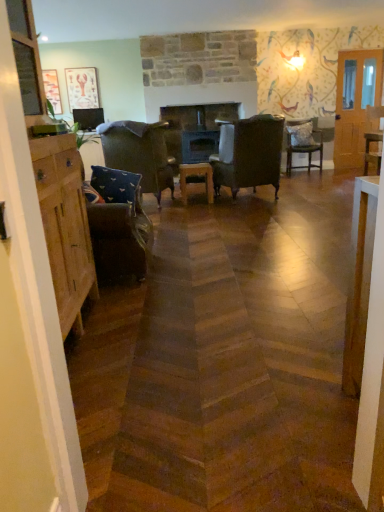
What is the approximate height of smooth dark wood fireplace at center?

1.04 meters.

What are the coordinates of `blue fabric pillow at left, placed as the 1th pillow when sorted from left to right` in the screenshot? It's located at (117, 186).

The width and height of the screenshot is (384, 512). What do you see at coordinates (249, 154) in the screenshot?
I see `brown leather chair at center, which is the 3th chair from right to left` at bounding box center [249, 154].

What is the approximate width of matte wooden picture frame at upper left, which is the first picture frame in left-to-right order?

matte wooden picture frame at upper left, which is the first picture frame in left-to-right order, is 1.96 inches in width.

Locate an element on the screen. This screenshot has height=512, width=384. matte wooden picture frame at upper left, which is the 2th picture frame in right-to-left order is located at coordinates (52, 90).

Image resolution: width=384 pixels, height=512 pixels. Describe the element at coordinates (302, 143) in the screenshot. I see `patterned fabric chair at center-right, arranged as the third chair when viewed from the left` at that location.

Where is `wooden stool at center`? This screenshot has height=512, width=384. wooden stool at center is located at coordinates (196, 180).

Is transparent glass door at right positioned beyond the bounds of matte wooden picture frame at upper left, which is the 2th picture frame in right-to-left order?

That's correct, transparent glass door at right is outside of matte wooden picture frame at upper left, which is the 2th picture frame in right-to-left order.

Is transparent glass door at right smaller than matte wooden picture frame at upper left, which is the 2th picture frame in right-to-left order?

Actually, transparent glass door at right might be larger than matte wooden picture frame at upper left, which is the 2th picture frame in right-to-left order.

Visually, is transparent glass door at right positioned to the left or to the right of matte wooden picture frame at upper left, which is the 2th picture frame in right-to-left order?

In the image, transparent glass door at right appears on the right side of matte wooden picture frame at upper left, which is the 2th picture frame in right-to-left order.

Looking at this image, considering the sizes of objects transparent glass door at right and matte wooden picture frame at upper left, which is the first picture frame in left-to-right order, in the image provided, who is taller, transparent glass door at right or matte wooden picture frame at upper left, which is the first picture frame in left-to-right order,?

transparent glass door at right.

Considering the relative positions of wooden chair at right, positioned as the 4th chair in left-to-right order, and wooden stool at center in the image provided, is wooden chair at right, positioned as the 4th chair in left-to-right order, to the right of wooden stool at center from the viewer's perspective?

Yes, wooden chair at right, positioned as the 4th chair in left-to-right order, is to the right of wooden stool at center.

Could you tell me if wooden chair at right, which appears as the 1th chair when viewed from the right, is facing wooden stool at center?

No, wooden chair at right, which appears as the 1th chair when viewed from the right, does not turn towards wooden stool at center.

From a real-world perspective, is wooden chair at right, which appears as the 1th chair when viewed from the right, positioned under wooden stool at center based on gravity?

No, from a real-world perspective, wooden chair at right, which appears as the 1th chair when viewed from the right, is not under wooden stool at center.

From the image's perspective, between wooden chair at right, positioned as the 4th chair in left-to-right order, and wooden stool at center, who is located below?

wooden stool at center, from the image's perspective.

Can you confirm if blue fabric pillow at left, marked as the second pillow in a right-to-left arrangement, is positioned to the right of patterned fabric chair at center-right, arranged as the third chair when viewed from the left?

Incorrect, blue fabric pillow at left, marked as the second pillow in a right-to-left arrangement, is not on the right side of patterned fabric chair at center-right, arranged as the third chair when viewed from the left.

From a real-world perspective, does blue fabric pillow at left, which is the 1th pillow from bottom to top, sit lower than patterned fabric chair at center-right, arranged as the third chair when viewed from the left?

No, from a real-world perspective, blue fabric pillow at left, which is the 1th pillow from bottom to top, is not under patterned fabric chair at center-right, arranged as the third chair when viewed from the left.

Considering the sizes of objects blue fabric pillow at left, which is the 1th pillow from bottom to top, and patterned fabric chair at center-right, arranged as the third chair when viewed from the left, in the image provided, who is bigger, blue fabric pillow at left, which is the 1th pillow from bottom to top, or patterned fabric chair at center-right, arranged as the third chair when viewed from the left,?

With larger size is patterned fabric chair at center-right, arranged as the third chair when viewed from the left.

Starting from the blue fabric pillow at left, marked as the second pillow in a right-to-left arrangement, which chair is the 4th one behind? Please provide its 2D coordinates.

[(302, 143)]

In the image, is textured gray pillow at center-right, which ranks as the 1th pillow in top-to-bottom order, positioned in front of or behind wooden chair at right, positioned as the 4th chair in left-to-right order?

textured gray pillow at center-right, which ranks as the 1th pillow in top-to-bottom order, is behind wooden chair at right, positioned as the 4th chair in left-to-right order.

Who is shorter, textured gray pillow at center-right, which appears as the first pillow when viewed from the back, or wooden chair at right, positioned as the 4th chair in left-to-right order?

textured gray pillow at center-right, which appears as the first pillow when viewed from the back, is shorter.

Is textured gray pillow at center-right, which appears as the first pillow when viewed from the back, oriented away from wooden chair at right, which appears as the 1th chair when viewed from the right?

No.

Does textured gray pillow at center-right, which appears as the first pillow when viewed from the back, have a lesser width compared to wooden chair at right, which appears as the 1th chair when viewed from the right?

Indeed, textured gray pillow at center-right, which appears as the first pillow when viewed from the back, has a lesser width compared to wooden chair at right, which appears as the 1th chair when viewed from the right.

Considering the positions of point (379, 168) and point (88, 70), is point (379, 168) closer or farther from the camera than point (88, 70)?

Point (379, 168) appears to be closer to the viewer than point (88, 70).

Is matte paper picture frame at upper left, the second picture frame when ordered from left to right, at the back of wooden chair at right, which appears as the 1th chair when viewed from the right?

wooden chair at right, which appears as the 1th chair when viewed from the right, is not turned away from matte paper picture frame at upper left, the second picture frame when ordered from left to right.

Considering the relative sizes of wooden chair at right, which appears as the 1th chair when viewed from the right, and matte paper picture frame at upper left, the second picture frame when ordered from left to right, in the image provided, is wooden chair at right, which appears as the 1th chair when viewed from the right, shorter than matte paper picture frame at upper left, the second picture frame when ordered from left to right,?

In fact, wooden chair at right, which appears as the 1th chair when viewed from the right, may be taller than matte paper picture frame at upper left, the second picture frame when ordered from left to right.

Can you confirm if textured gray pillow at center-right, which appears as the first pillow when viewed from the back, is positioned to the left of brown leather chair at center, positioned as the second chair in left-to-right order?

Incorrect, textured gray pillow at center-right, which appears as the first pillow when viewed from the back, is not on the left side of brown leather chair at center, positioned as the second chair in left-to-right order.

From the image's perspective, is textured gray pillow at center-right, which ranks as the 1th pillow in top-to-bottom order, above or below brown leather chair at center, which is the 3th chair from right to left?

Based on their image positions, textured gray pillow at center-right, which ranks as the 1th pillow in top-to-bottom order, is located above brown leather chair at center, which is the 3th chair from right to left.

Based on the photo, which object is thinner, textured gray pillow at center-right, the 2th pillow in the front-to-back sequence, or brown leather chair at center, positioned as the second chair in left-to-right order?

textured gray pillow at center-right, the 2th pillow in the front-to-back sequence, is thinner.

Is textured gray pillow at center-right, which appears as the first pillow when viewed from the back, facing away from brown leather chair at center, positioned as the second chair in left-to-right order?

textured gray pillow at center-right, which appears as the first pillow when viewed from the back, is not turned away from brown leather chair at center, positioned as the second chair in left-to-right order.

Is velvet green armchair at center, arranged as the first chair when viewed from the left, not within textured gray pillow at center-right, the 2th pillow ordered from the bottom?

velvet green armchair at center, arranged as the first chair when viewed from the left, lies outside textured gray pillow at center-right, the 2th pillow ordered from the bottom,'s area.

From the image's perspective, between velvet green armchair at center, the fourth chair positioned from the right, and textured gray pillow at center-right, the 2th pillow ordered from the bottom, who is located below?

velvet green armchair at center, the fourth chair positioned from the right.

From a real-world perspective, is velvet green armchair at center, arranged as the first chair when viewed from the left, on textured gray pillow at center-right, the 2th pillow in the front-to-back sequence?

Actually, velvet green armchair at center, arranged as the first chair when viewed from the left, is physically below textured gray pillow at center-right, the 2th pillow in the front-to-back sequence, in the real world.

From the image's perspective, which picture frame is the 1st one above the transparent glass door at right? Please provide its 2D coordinates.

[(52, 90)]

At what (x,y) coordinates should I click in order to perform the action: click on table on the left of the wooden chair at right, positioned as the 4th chair in left-to-right order. Please return your answer as a coordinate pair (x, y). This screenshot has width=384, height=512. Looking at the image, I should click on (196, 180).

Considering their positions, is smooth dark wood fireplace at center positioned further to wooden stool at center than textured gray pillow at center-right, the 2th pillow in the front-to-back sequence?

textured gray pillow at center-right, the 2th pillow in the front-to-back sequence, is positioned further to the anchor wooden stool at center.

Estimate the real-world distances between objects in this image. Which object is closer to smooth dark wood fireplace at center, wooden stool at center or wooden chair at right, which appears as the 1th chair when viewed from the right?

Among the two, wooden stool at center is located nearer to smooth dark wood fireplace at center.

Estimate the real-world distances between objects in this image. Which object is closer to matte wooden picture frame at upper left, which is the 2th picture frame in right-to-left order, patterned fabric chair at center-right, which is counted as the second chair, starting from the right, or transparent glass door at right?

patterned fabric chair at center-right, which is counted as the second chair, starting from the right, is positioned closer to the anchor matte wooden picture frame at upper left, which is the 2th picture frame in right-to-left order.

Which object lies nearer to the anchor point transparent glass door at right, wooden chair at right, which appears as the 1th chair when viewed from the right, or smooth dark wood fireplace at center?

wooden chair at right, which appears as the 1th chair when viewed from the right, lies closer to transparent glass door at right than the other object.

Which object lies nearer to the anchor point transparent glass door at right, brown leather chair at center, positioned as the second chair in left-to-right order, or smooth dark wood fireplace at center?

Based on the image, smooth dark wood fireplace at center appears to be nearer to transparent glass door at right.

Looking at the image, which one is located further to matte paper picture frame at upper left, the second picture frame when ordered from left to right, matte wooden picture frame at upper left, which is the first picture frame in left-to-right order, or patterned fabric chair at center-right, which is counted as the second chair, starting from the right?

Based on the image, patterned fabric chair at center-right, which is counted as the second chair, starting from the right, appears to be further to matte paper picture frame at upper left, the second picture frame when ordered from left to right.

Which object lies further to the anchor point velvet green armchair at center, arranged as the first chair when viewed from the left, textured gray pillow at center-right, acting as the 2th pillow starting from the left, or brown leather chair at center, which is the 3th chair from right to left?

The object further to velvet green armchair at center, arranged as the first chair when viewed from the left, is textured gray pillow at center-right, acting as the 2th pillow starting from the left.

Based on their spatial positions, is patterned fabric chair at center-right, which is counted as the second chair, starting from the right, or transparent glass door at right closer to wooden chair at right, which appears as the 1th chair when viewed from the right?

transparent glass door at right is closer to wooden chair at right, which appears as the 1th chair when viewed from the right.

Where is `chair between wooden chair at right, which appears as the 1th chair when viewed from the right, and transparent glass door at right in the front-back direction`? This screenshot has height=512, width=384. chair between wooden chair at right, which appears as the 1th chair when viewed from the right, and transparent glass door at right in the front-back direction is located at coordinates (302, 143).

Find the location of a particular element. The width and height of the screenshot is (384, 512). fireplace between velvet green armchair at center, arranged as the first chair when viewed from the left, and wooden chair at right, positioned as the 4th chair in left-to-right order is located at coordinates (195, 129).

The height and width of the screenshot is (512, 384). Find the location of `table between matte paper picture frame at upper left, the second picture frame when ordered from left to right, and wooden chair at right, which appears as the 1th chair when viewed from the right, from left to right`. table between matte paper picture frame at upper left, the second picture frame when ordered from left to right, and wooden chair at right, which appears as the 1th chair when viewed from the right, from left to right is located at coordinates (196, 180).

Identify the location of table positioned between blue fabric pillow at left, acting as the second pillow starting from the top, and smooth dark wood fireplace at center from near to far. (196, 180).